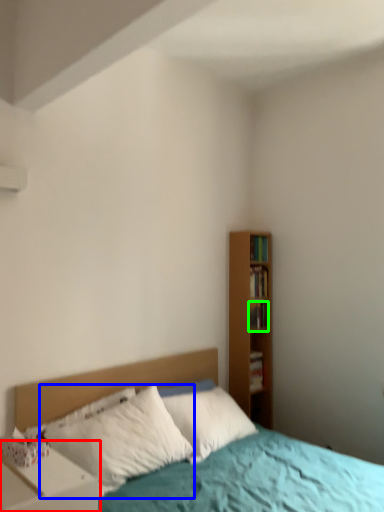
Question: Estimate the real-world distances between objects in this image. Which object is closer to nightstand (highlighted by a red box), pillow (highlighted by a blue box) or book (highlighted by a green box)?

Choices:
 (A) pillow
 (B) book

Answer: (A)